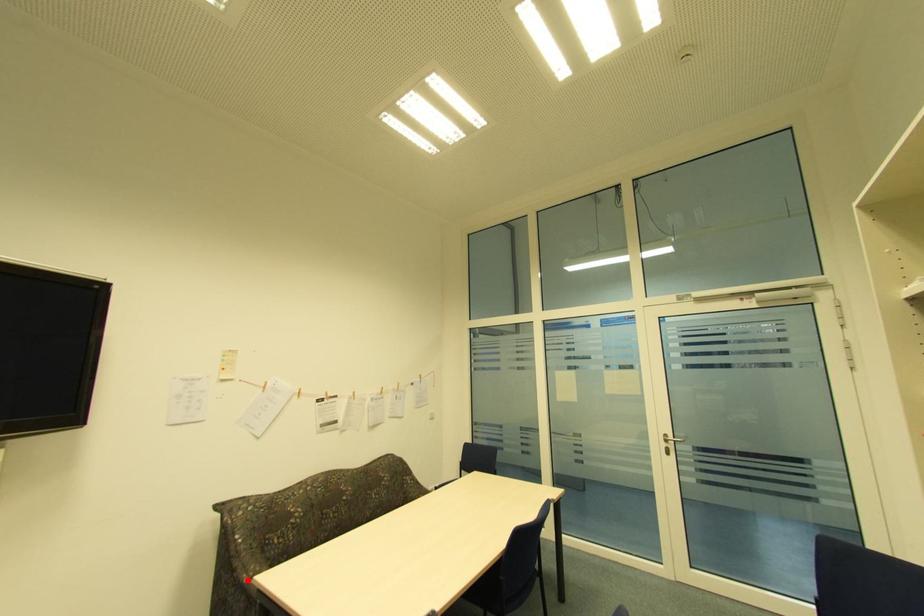
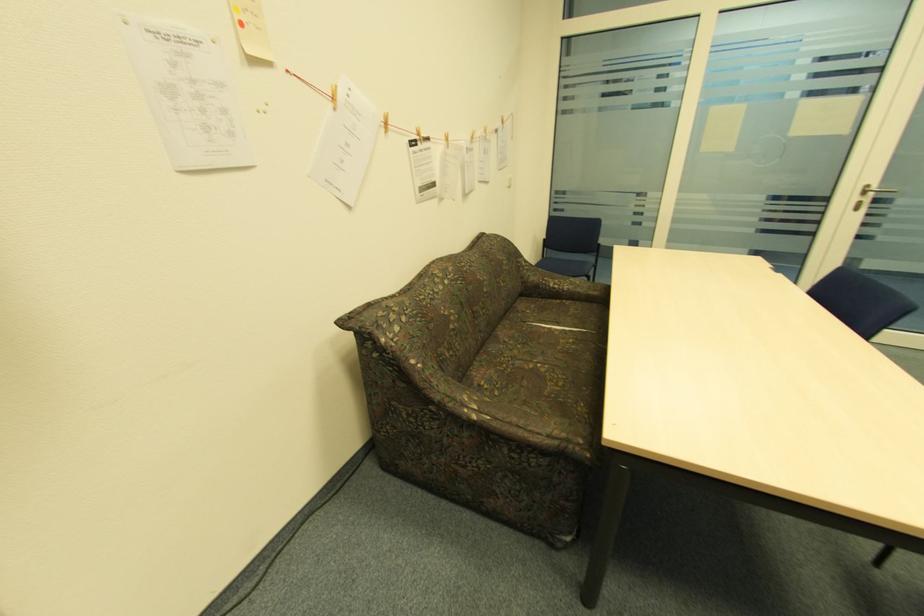
Question: I am providing you with two images of the same scene from different viewpoints. Given a red point in image1, look at the same physical point in image2. Is it:

Choices:
 (A) Closer to the viewpoint
 (B) Farther from the viewpoint

Answer: (B)